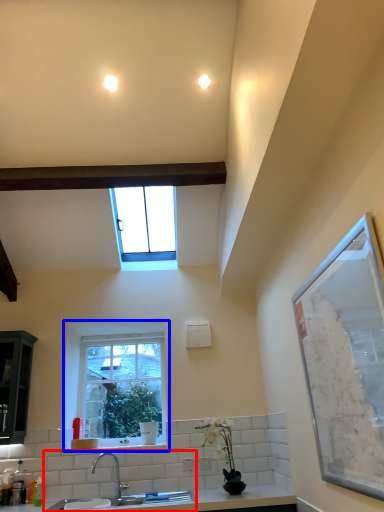
Question: Which object appears farthest to the camera in this image, sink (highlighted by a red box) or window (highlighted by a blue box)?

Choices:
 (A) sink
 (B) window

Answer: (B)